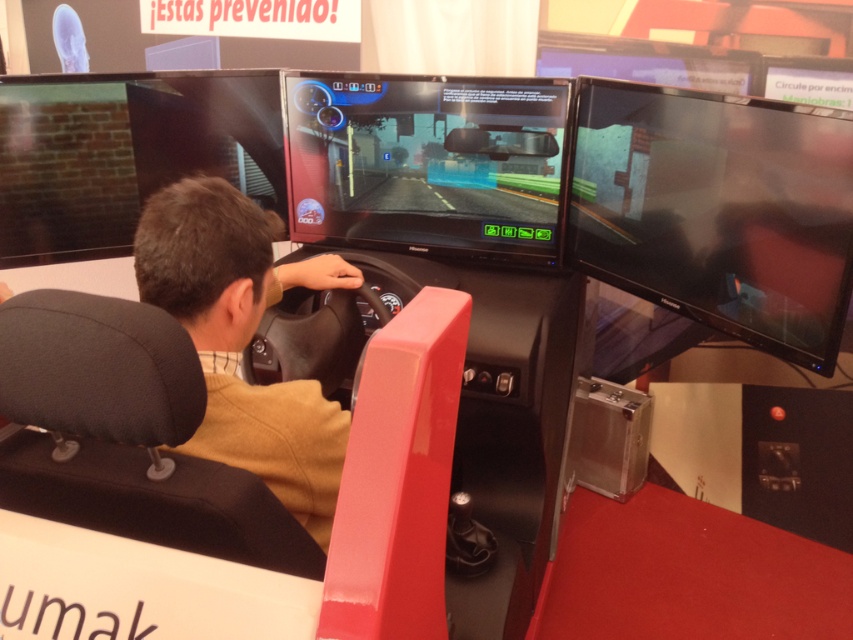
Image resolution: width=853 pixels, height=640 pixels. What do you see at coordinates (427, 161) in the screenshot?
I see `matte black monitor at center` at bounding box center [427, 161].

Is matte black monitor at center above matte black monitor at upper center?

No.

At what (x,y) coordinates should I click in order to perform the action: click on matte black monitor at center. Please return your answer as a coordinate pair (x, y). The height and width of the screenshot is (640, 853). Looking at the image, I should click on (427, 161).

Is matte black monitor at right smaller than brown leather jacket at center?

No, matte black monitor at right is not smaller than brown leather jacket at center.

Measure the distance from matte black monitor at right to brown leather jacket at center.

94.04 centimeters

Describe the element at coordinates (718, 211) in the screenshot. I see `matte black monitor at right` at that location.

Find the location of `matte black monitor at right`. matte black monitor at right is located at coordinates (718, 211).

Is brown leather jacket at center smaller than matte black monitor at upper center?

No, brown leather jacket at center is not smaller than matte black monitor at upper center.

Is brown leather jacket at center to the right of matte black monitor at upper center from the viewer's perspective?

In fact, brown leather jacket at center is to the left of matte black monitor at upper center.

Is point (215, 234) positioned after point (703, 45)?

That is False.

Where is `brown leather jacket at center`? brown leather jacket at center is located at coordinates (242, 340).